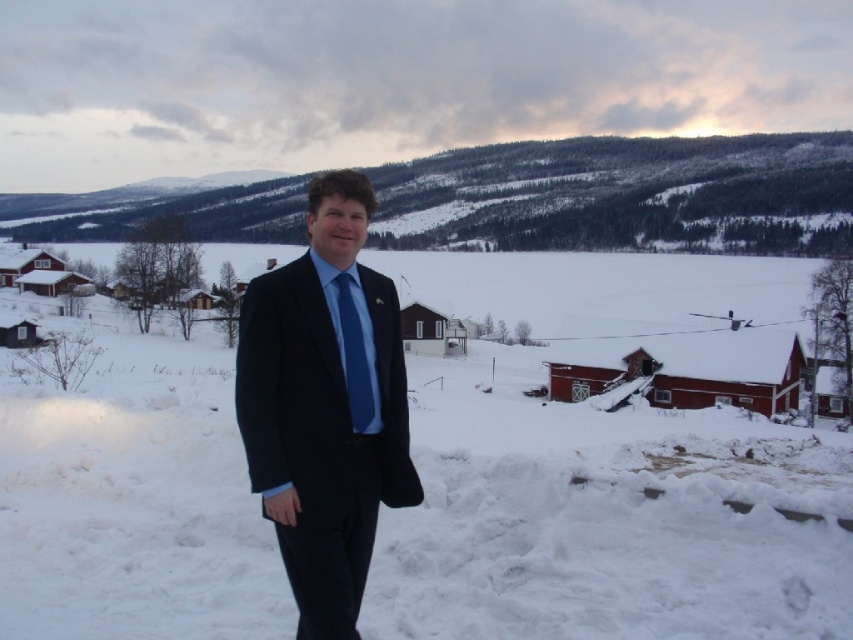
Between matte black suit at center and blue silk tie at center, which one has more height?

With more height is matte black suit at center.

What do you see at coordinates (325, 404) in the screenshot? The width and height of the screenshot is (853, 640). I see `matte black suit at center` at bounding box center [325, 404].

Does point (393, 330) come behind point (335, 276)?

Yes.

Where is `matte black suit at center`? matte black suit at center is located at coordinates (325, 404).

Can you confirm if white fluffy snow at center is positioned above blue silk tie at center?

Yes.

Can you confirm if white fluffy snow at center is wider than blue silk tie at center?

Yes.

This screenshot has height=640, width=853. Identify the location of white fluffy snow at center. (601, 518).

I want to click on white fluffy snow at center, so click(601, 518).

Does white fluffy snow at center appear on the right side of matte black suit at center?

Correct, you'll find white fluffy snow at center to the right of matte black suit at center.

Where is `white fluffy snow at center`? white fluffy snow at center is located at coordinates (601, 518).